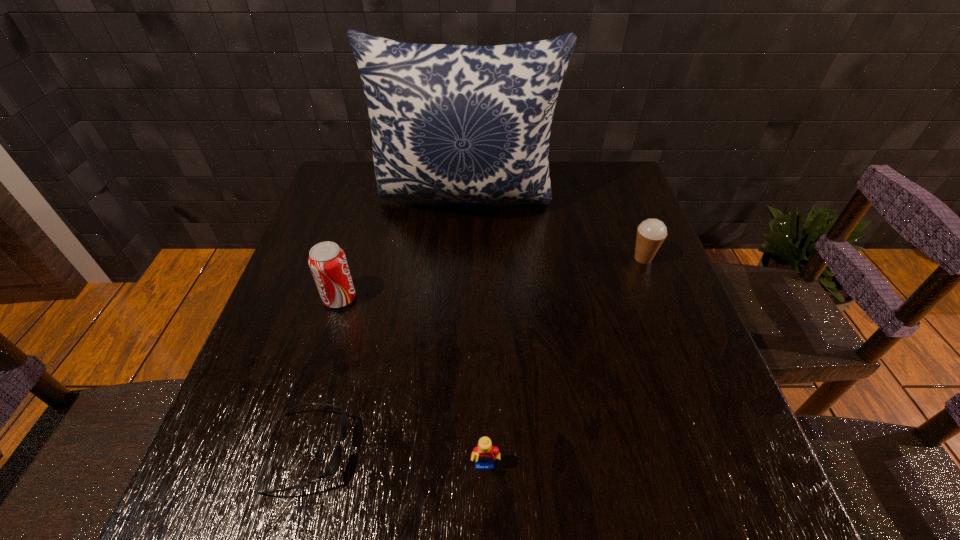
Where is `cushion`? This screenshot has width=960, height=540. cushion is located at coordinates (461, 123).

Find the location of a particular element. the tallest object is located at coordinates click(x=461, y=123).

Image resolution: width=960 pixels, height=540 pixels. I want to click on soda can, so click(327, 261).

What are the coordinates of `the second tallest object` in the screenshot? It's located at (327, 261).

You are a GUI agent. You are given a task and a screenshot of the screen. Output one action in this format:
    pyautogui.click(x=<x>, y=<y>)
    Task: Click on the rightmost object
    This screenshot has width=960, height=540.
    Given the screenshot: What is the action you would take?
    pyautogui.click(x=651, y=233)

The image size is (960, 540). I want to click on the fourth nearest object, so click(x=651, y=233).

You are a GUI agent. You are given a task and a screenshot of the screen. Output one action in this format:
    pyautogui.click(x=<x>, y=<y>)
    Task: Click on the Lego
    The height and width of the screenshot is (540, 960).
    Given the screenshot: What is the action you would take?
    pyautogui.click(x=484, y=453)

Where is `sunglasses`? The height and width of the screenshot is (540, 960). sunglasses is located at coordinates (334, 464).

Where is `free space located on the front surface of the farthest object`? Image resolution: width=960 pixels, height=540 pixels. free space located on the front surface of the farthest object is located at coordinates (464, 263).

What are the coordinates of `vacant space located on the logo side of the soda can` in the screenshot? It's located at (477, 298).